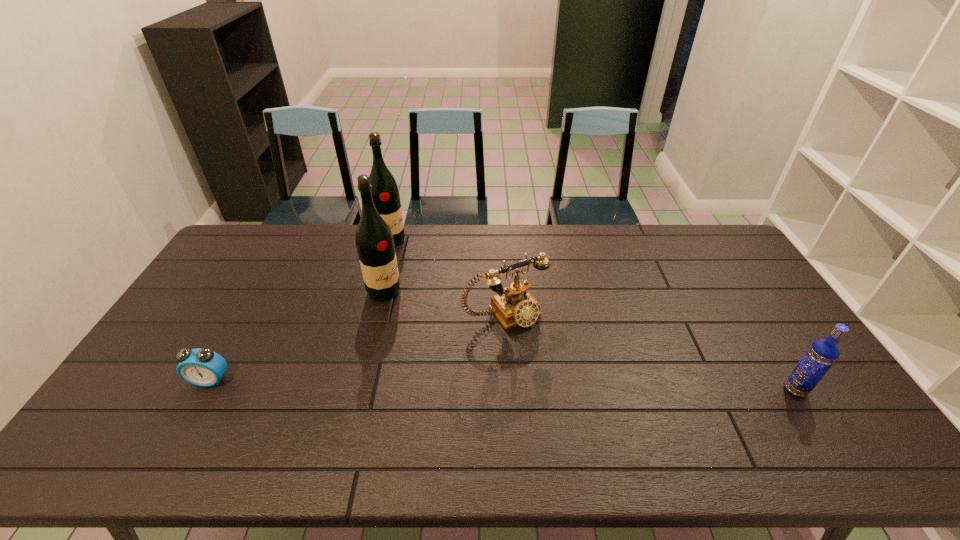
This screenshot has width=960, height=540. Find the location of `free space that satisfies the following two spatial constraints: 1. on the front side of the third tallest object; 2. on the left side of the nearer liquor`. free space that satisfies the following two spatial constraints: 1. on the front side of the third tallest object; 2. on the left side of the nearer liquor is located at coordinates (360, 390).

Identify the location of free space that satisfies the following two spatial constraints: 1. on the face of the rightmost object; 2. on the left side of the shortest object. The height and width of the screenshot is (540, 960). (205, 390).

Where is `vacant space that satisfies the following two spatial constraints: 1. on the face of the shortest object; 2. on the right side of the rightmost object`? This screenshot has width=960, height=540. vacant space that satisfies the following two spatial constraints: 1. on the face of the shortest object; 2. on the right side of the rightmost object is located at coordinates (205, 390).

You are a GUI agent. You are given a task and a screenshot of the screen. Output one action in this format:
    pyautogui.click(x=<x>, y=<y>)
    Task: Click on the vacant space that satisfies the following two spatial constraints: 1. on the front side of the fourth tallest object; 2. on the left side of the nearer liquor
    
    Given the screenshot: What is the action you would take?
    pyautogui.click(x=379, y=313)